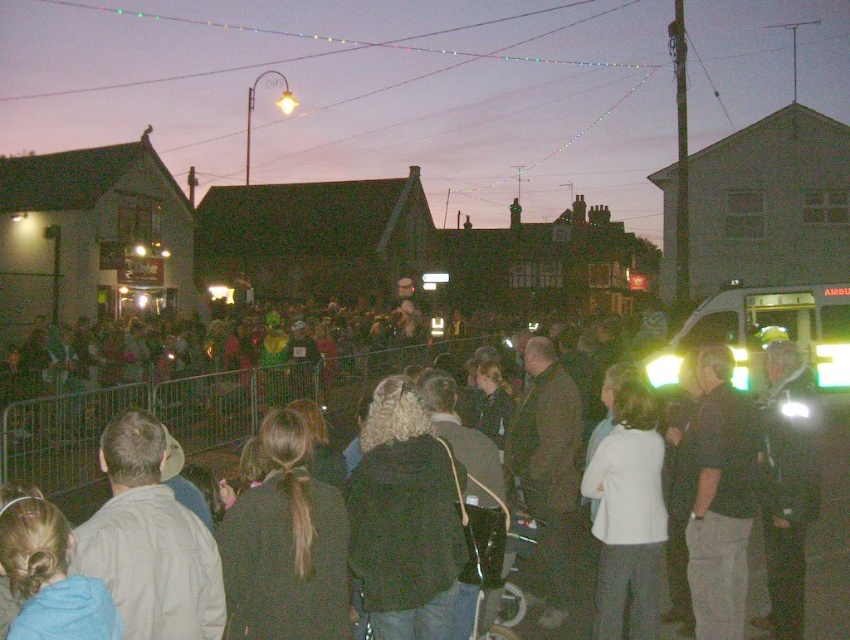
Question: Which point is closer to the camera taking this photo?

Choices:
 (A) pyautogui.click(x=610, y=476)
 (B) pyautogui.click(x=61, y=449)

Answer: (A)

Question: Is dark gray clothing at center thinner than white matte jacket at center?

Choices:
 (A) no
 (B) yes

Answer: (A)

Question: Can you confirm if dark gray clothing at center is positioned to the right of white matte jacket at center?

Choices:
 (A) no
 (B) yes

Answer: (A)

Question: Among these objects, which one is nearest to the camera?

Choices:
 (A) dark gray clothing at center
 (B) white matte jacket at center

Answer: (A)

Question: Does dark gray clothing at center appear on the left side of white matte jacket at center?

Choices:
 (A) yes
 (B) no

Answer: (A)